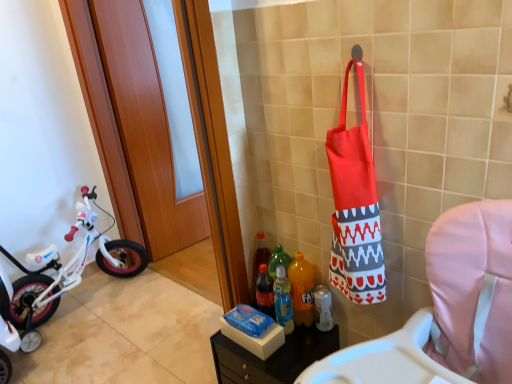
Question: Is red fabric tote bag at right located within translucent plastic bottle at lower center, which is the 3th bottle from right to left?

Choices:
 (A) yes
 (B) no

Answer: (B)

Question: Is translucent plastic bottle at lower center, acting as the first bottle starting from the left, touching red fabric tote bag at right?

Choices:
 (A) yes
 (B) no

Answer: (B)

Question: Can you confirm if translucent plastic bottle at lower center, which is the 3th bottle from right to left, is positioned to the right of red fabric tote bag at right?

Choices:
 (A) no
 (B) yes

Answer: (A)

Question: Does translucent plastic bottle at lower center, which is the 3th bottle from right to left, lie in front of red fabric tote bag at right?

Choices:
 (A) yes
 (B) no

Answer: (B)

Question: From a real-world perspective, is translucent plastic bottle at lower center, acting as the first bottle starting from the left, on red fabric tote bag at right?

Choices:
 (A) yes
 (B) no

Answer: (B)

Question: Is red fabric tote bag at right taller or shorter than matte plastic tray at lower center?

Choices:
 (A) short
 (B) tall

Answer: (B)

Question: Is red fabric tote bag at right wider or thinner than matte plastic tray at lower center?

Choices:
 (A) wide
 (B) thin

Answer: (B)

Question: From a real-world perspective, is red fabric tote bag at right positioned above or below matte plastic tray at lower center?

Choices:
 (A) below
 (B) above

Answer: (B)

Question: Based on their positions, is red fabric tote bag at right located to the left or right of matte plastic tray at lower center?

Choices:
 (A) right
 (B) left

Answer: (A)

Question: Considering the positions of white matte bicycle at left and matte plastic tray at lower center in the image, is white matte bicycle at left wider or thinner than matte plastic tray at lower center?

Choices:
 (A) wide
 (B) thin

Answer: (A)

Question: Is point (23, 266) closer or farther from the camera than point (317, 342)?

Choices:
 (A) closer
 (B) farther

Answer: (B)

Question: Is white matte bicycle at left situated inside matte plastic tray at lower center or outside?

Choices:
 (A) outside
 (B) inside

Answer: (A)

Question: Looking at the image, does white matte bicycle at left seem bigger or smaller compared to matte plastic tray at lower center?

Choices:
 (A) small
 (B) big

Answer: (B)

Question: From a real-world perspective, is white matte bicycle at left positioned above or below red fabric tote bag at right?

Choices:
 (A) below
 (B) above

Answer: (A)

Question: In terms of width, does white matte bicycle at left look wider or thinner when compared to red fabric tote bag at right?

Choices:
 (A) wide
 (B) thin

Answer: (A)